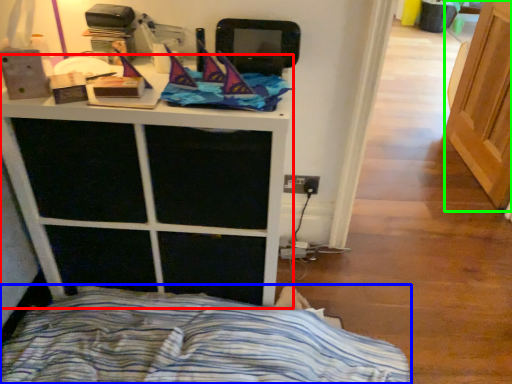
Question: Which is farther away from furniture (highlighted by a red box)? bed (highlighted by a blue box) or screen door (highlighted by a green box)?

Choices:
 (A) bed
 (B) screen door

Answer: (B)